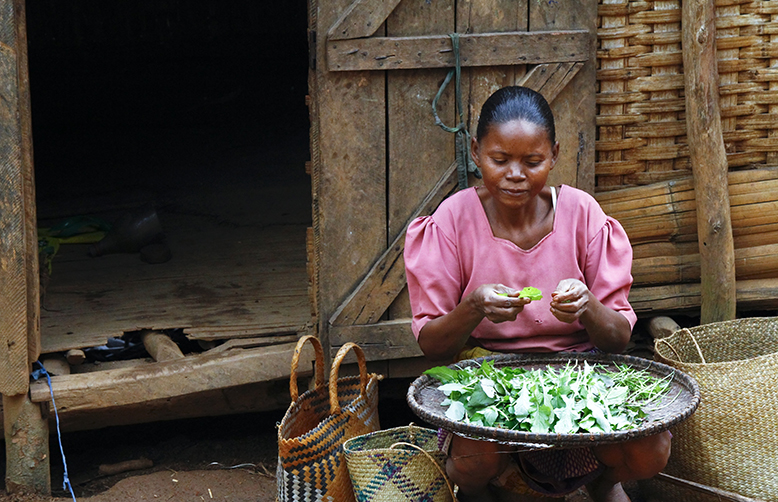
Locate an element on the screen. Image resolution: width=778 pixels, height=502 pixels. baskets is located at coordinates (731, 398), (401, 459), (326, 455).